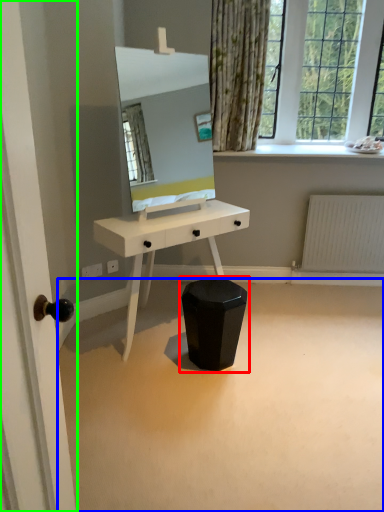
Question: Which object is positioned closest to swivel chair (highlighted by a red box)? Select from plain (highlighted by a blue box) and door (highlighted by a green box).

Choices:
 (A) plain
 (B) door

Answer: (A)